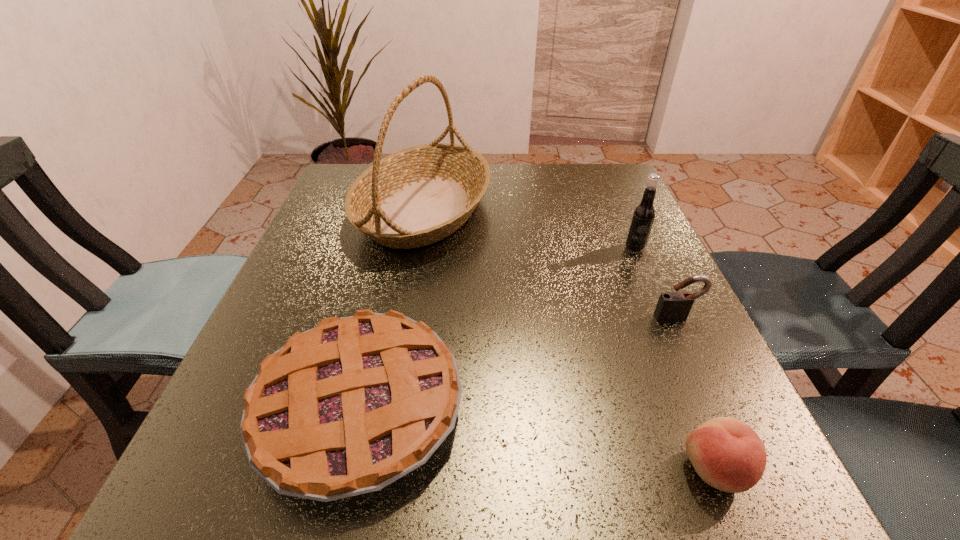
Image resolution: width=960 pixels, height=540 pixels. Identify the location of object that is the closest one to the basket. (346, 408).